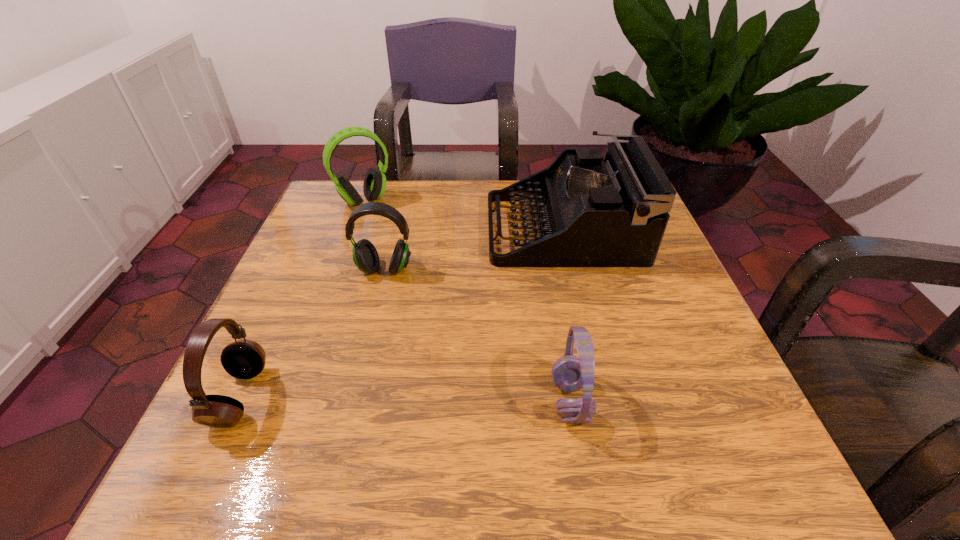
The width and height of the screenshot is (960, 540). I want to click on the farthest headset, so [x=374, y=186].

Where is `typewriter`? typewriter is located at coordinates (591, 212).

You are a GUI agent. You are given a task and a screenshot of the screen. Output one action in this format:
    pyautogui.click(x=<x>, y=<y>)
    Task: Click on the second farthest headset
    The height and width of the screenshot is (540, 960).
    Given the screenshot: What is the action you would take?
    pyautogui.click(x=365, y=256)

Image resolution: width=960 pixels, height=540 pixels. I want to click on the rightmost headset, so click(570, 373).

The width and height of the screenshot is (960, 540). In order to click on free space located on the front of the tallest headset in this screenshot , I will do `click(323, 317)`.

You are a GUI agent. You are given a task and a screenshot of the screen. Output one action in this format:
    pyautogui.click(x=<x>, y=<y>)
    Task: Click on the blank area located 0.240m on the typing side of the typewriter
    The width and height of the screenshot is (960, 540).
    Given the screenshot: What is the action you would take?
    pyautogui.click(x=389, y=229)

In order to click on free point located on the typing side of the typewriter in this screenshot , I will do `click(372, 229)`.

Find the location of a particular element. vacant space located 0.190m on the typing side of the typewriter is located at coordinates (409, 229).

What are the coordinates of `free location located 0.190m on the ear cups of the third nearest headset` in the screenshot? It's located at (364, 354).

Identify the location of blank space located on the headband and ear cups of the rightmost headset. Image resolution: width=960 pixels, height=540 pixels. (495, 401).